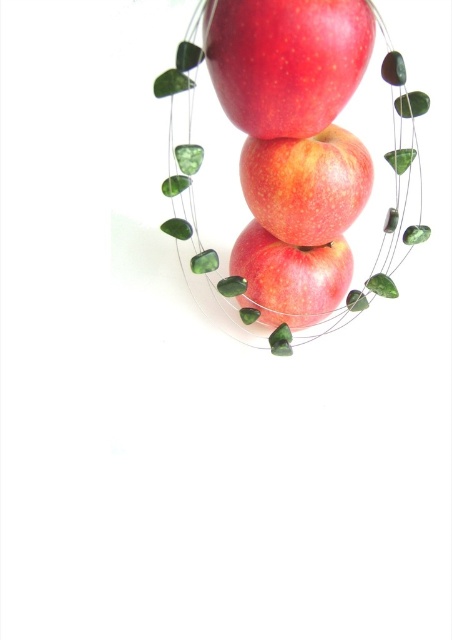
Which is below, red matte apple at center or glossy red apple at center?

glossy red apple at center is below.

Where is `red matte apple at center`? red matte apple at center is located at coordinates (306, 184).

Can you confirm if green gemstone necklace at center is positioned to the left of shiny red apple at center?

In fact, green gemstone necklace at center is to the right of shiny red apple at center.

Between green gemstone necklace at center and shiny red apple at center, which one is positioned lower?

green gemstone necklace at center is below.

Is point (281, 253) positioned behind point (273, 83)?

Yes, it is behind point (273, 83).

Identify the location of green gemstone necklace at center. The width and height of the screenshot is (452, 640). (293, 161).

Between shiny red apple at center and red matte apple at center, which one is positioned higher?

Positioned higher is shiny red apple at center.

Between shiny red apple at center and red matte apple at center, which one appears on the left side from the viewer's perspective?

From the viewer's perspective, shiny red apple at center appears more on the left side.

The image size is (452, 640). What do you see at coordinates (286, 60) in the screenshot?
I see `shiny red apple at center` at bounding box center [286, 60].

The height and width of the screenshot is (640, 452). In order to click on shiny red apple at center in this screenshot , I will do `click(286, 60)`.